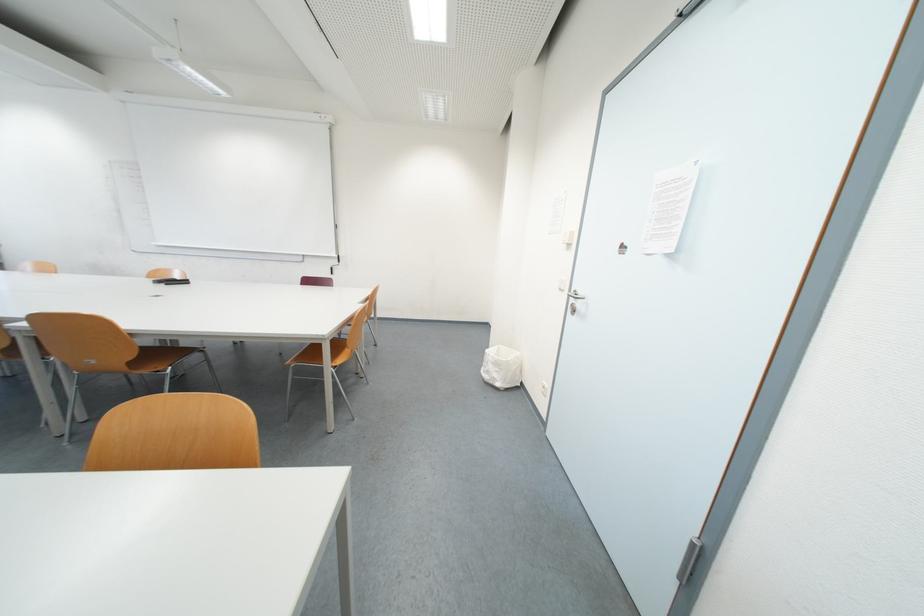
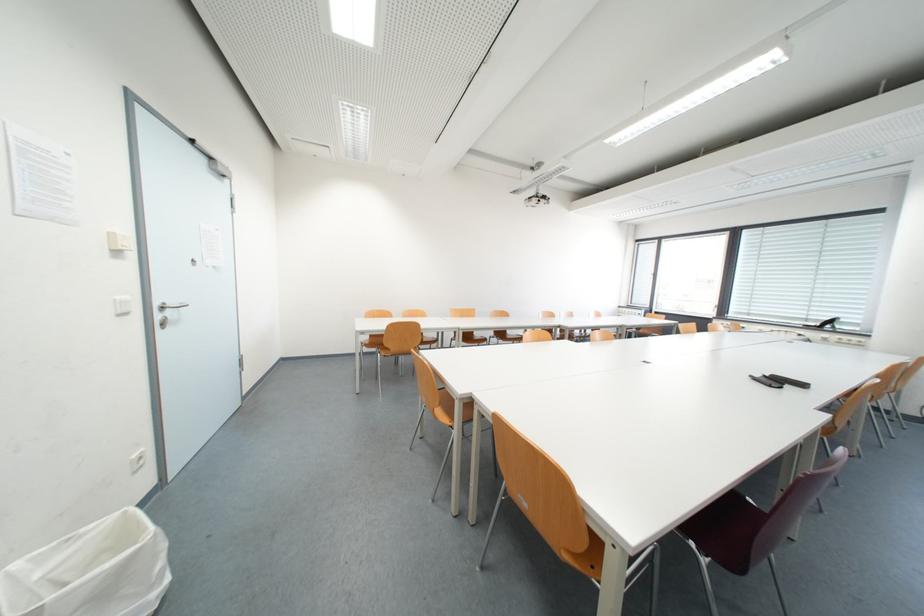
Find the pixel in the second image that matches the point at 591,294 in the first image.

(178, 305)